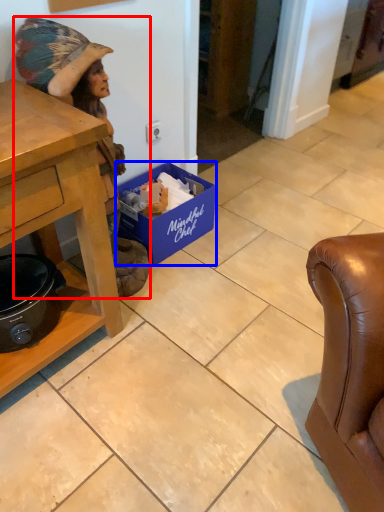
Question: Among these objects, which one is farthest to the camera, person (highlighted by a red box) or box (highlighted by a blue box)?

Choices:
 (A) person
 (B) box

Answer: (B)